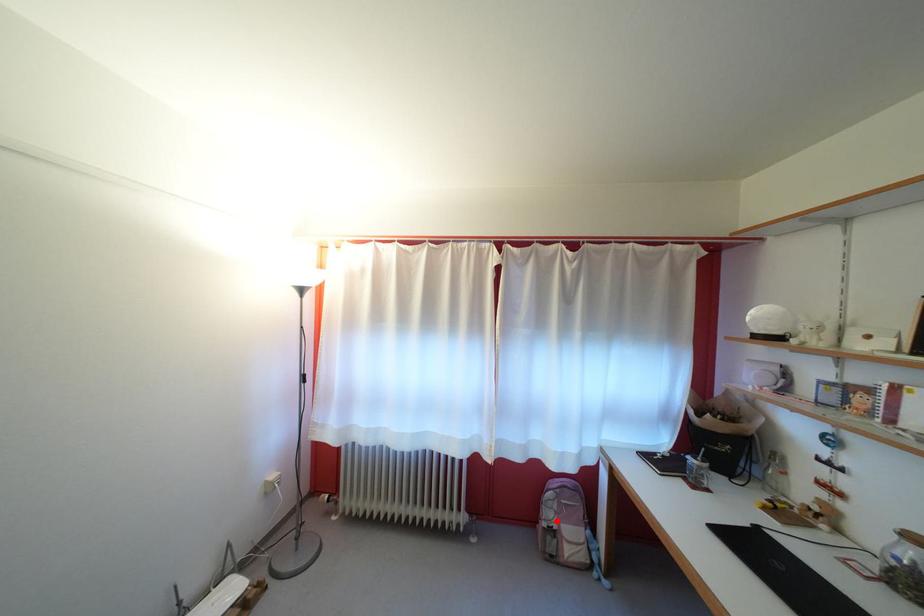
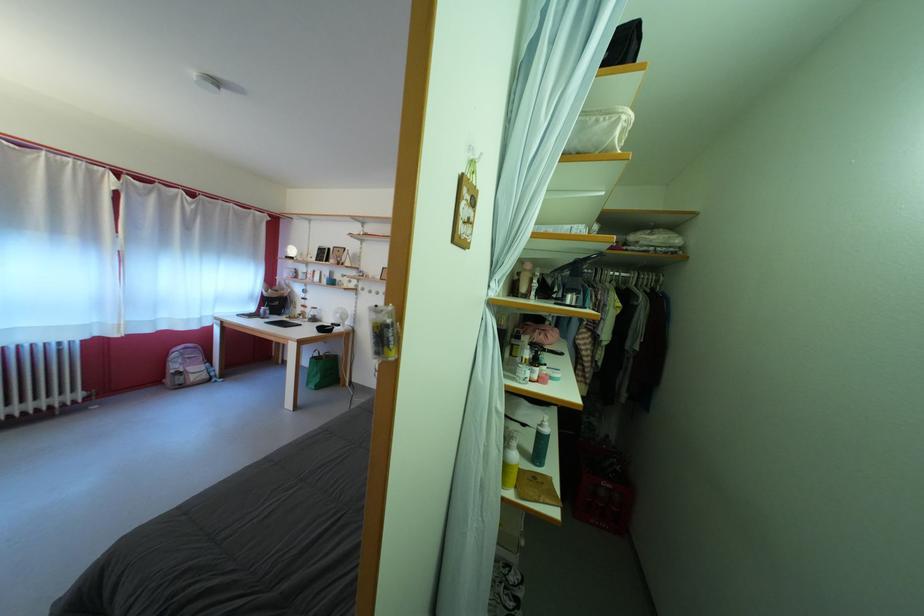
Locate, in the second image, the point that corresponds to the highlighted location in the first image.

(184, 373)